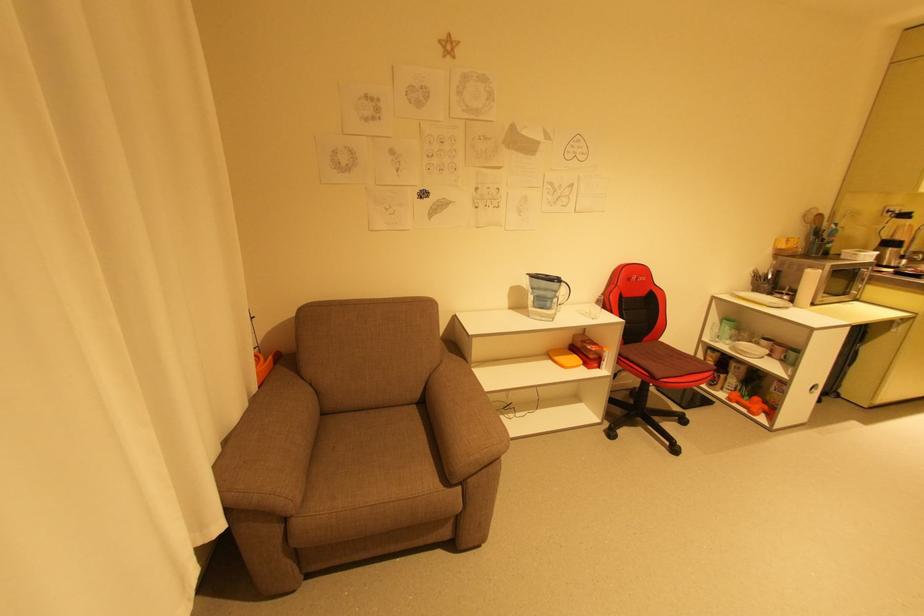
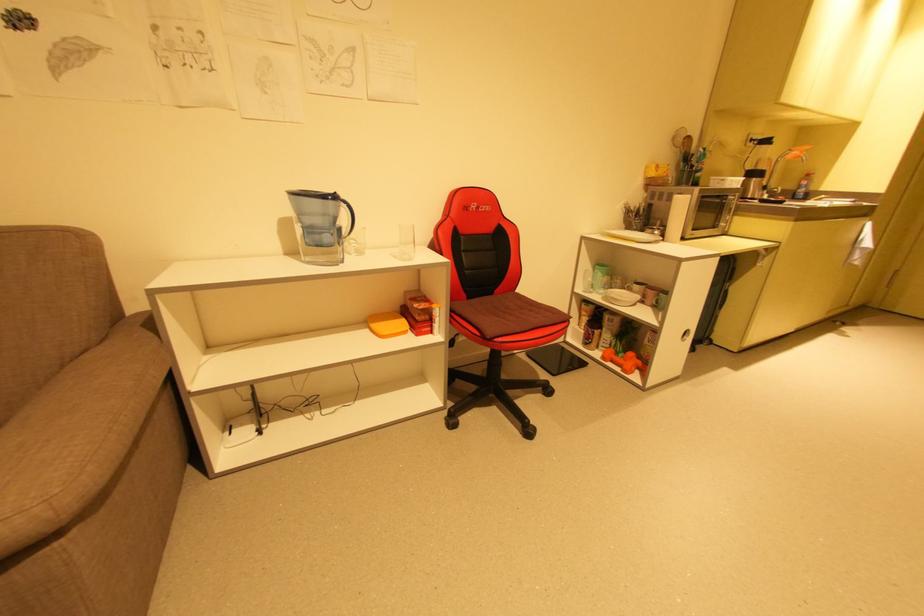
In the second image, find the point that corresponds to (x=567, y=284) in the first image.

(346, 204)